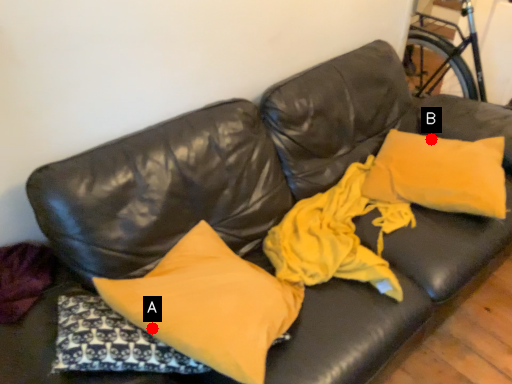
Question: Two points are circled on the image, labeled by A and B beside each circle. Which point appears closest to the camera in this image?

Choices:
 (A) A is closer
 (B) B is closer

Answer: (A)